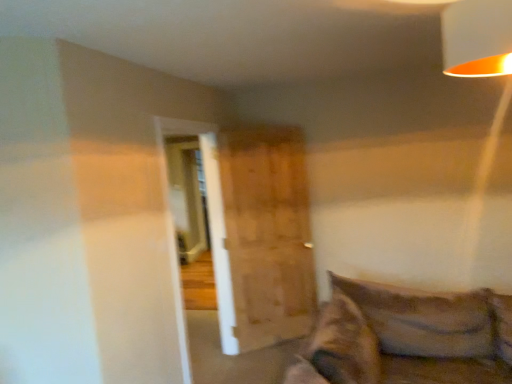
Question: Considering the relative sizes of orange matte lampshade at upper right and wooden barn door at center in the image provided, is orange matte lampshade at upper right bigger than wooden barn door at center?

Choices:
 (A) yes
 (B) no

Answer: (B)

Question: From a real-world perspective, is orange matte lampshade at upper right physically below wooden barn door at center?

Choices:
 (A) no
 (B) yes

Answer: (A)

Question: Is orange matte lampshade at upper right thinner than wooden barn door at center?

Choices:
 (A) yes
 (B) no

Answer: (B)

Question: Would you say orange matte lampshade at upper right contains wooden barn door at center?

Choices:
 (A) yes
 (B) no

Answer: (B)

Question: From a real-world perspective, does orange matte lampshade at upper right stand above wooden barn door at center?

Choices:
 (A) no
 (B) yes

Answer: (B)

Question: Considering the relative positions of orange matte lampshade at upper right and wooden barn door at center in the image provided, is orange matte lampshade at upper right to the left of wooden barn door at center from the viewer's perspective?

Choices:
 (A) yes
 (B) no

Answer: (B)

Question: Does wooden barn door at center have a greater width compared to orange matte lampshade at upper right?

Choices:
 (A) yes
 (B) no

Answer: (B)

Question: From a real-world perspective, is wooden barn door at center located beneath orange matte lampshade at upper right?

Choices:
 (A) yes
 (B) no

Answer: (A)

Question: From the image's perspective, would you say wooden barn door at center is shown under orange matte lampshade at upper right?

Choices:
 (A) yes
 (B) no

Answer: (A)

Question: Can you confirm if wooden barn door at center is positioned to the right of orange matte lampshade at upper right?

Choices:
 (A) no
 (B) yes

Answer: (A)

Question: Is wooden barn door at center looking in the opposite direction of orange matte lampshade at upper right?

Choices:
 (A) no
 (B) yes

Answer: (A)

Question: Is wooden barn door at center not inside orange matte lampshade at upper right?

Choices:
 (A) yes
 (B) no

Answer: (A)

Question: From the image's perspective, is orange matte lampshade at upper right above or below wooden barn door at center?

Choices:
 (A) below
 (B) above

Answer: (B)